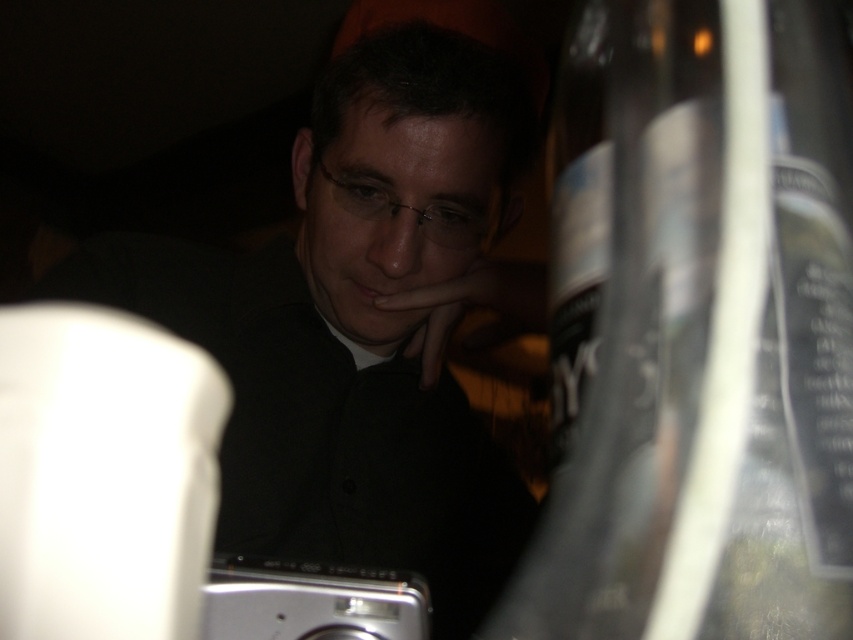
Question: Is matte black shirt at center positioned at the back of silver metallic camera at lower center?

Choices:
 (A) yes
 (B) no

Answer: (A)

Question: Which is farther from the silver metallic camera at lower center?

Choices:
 (A) matte black shirt at center
 (B) transparent plastic bottle at center-right

Answer: (A)

Question: Considering the relative positions of transparent plastic bottle at center-right and matte black shirt at center in the image provided, where is transparent plastic bottle at center-right located with respect to matte black shirt at center?

Choices:
 (A) right
 (B) left

Answer: (A)

Question: Can you confirm if transparent plastic bottle at center-right is wider than matte black shirt at center?

Choices:
 (A) no
 (B) yes

Answer: (A)

Question: Which point is farther from the camera taking this photo?

Choices:
 (A) (532, 504)
 (B) (286, 630)
 (C) (776, 577)

Answer: (A)

Question: Which is nearer to the silver metallic camera at lower center?

Choices:
 (A) matte black shirt at center
 (B) transparent plastic bottle at center-right

Answer: (B)